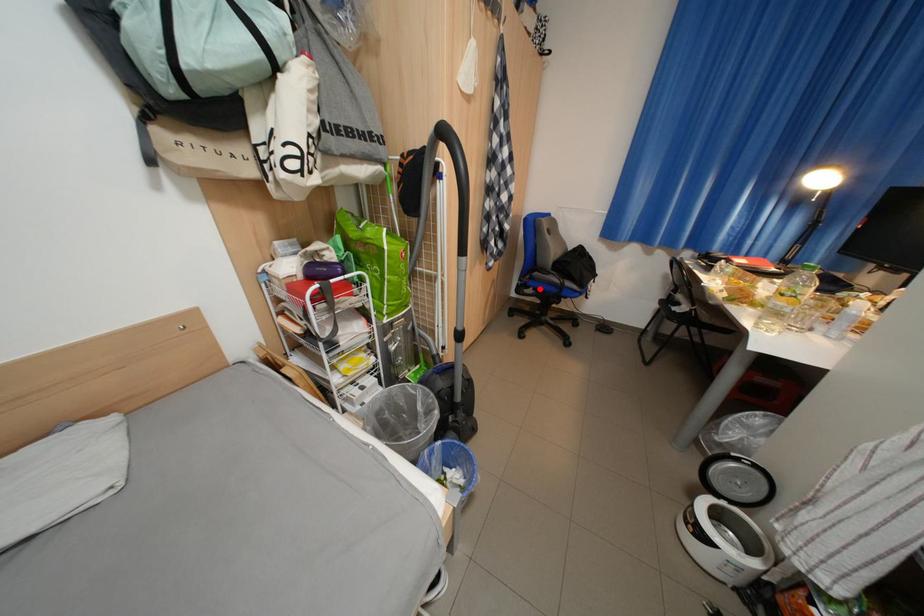
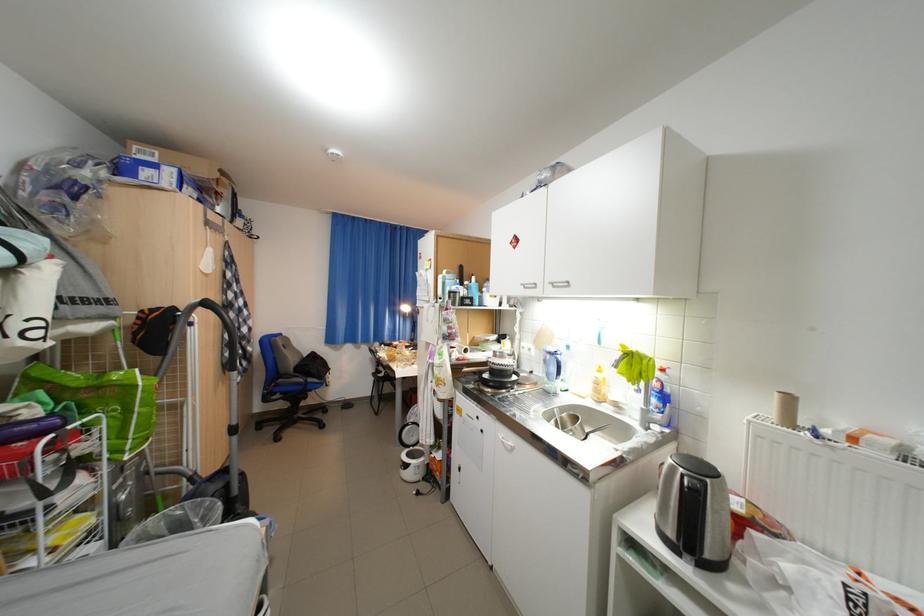
In the second image, find the point that corresponds to the highlighted location in the first image.

(286, 395)